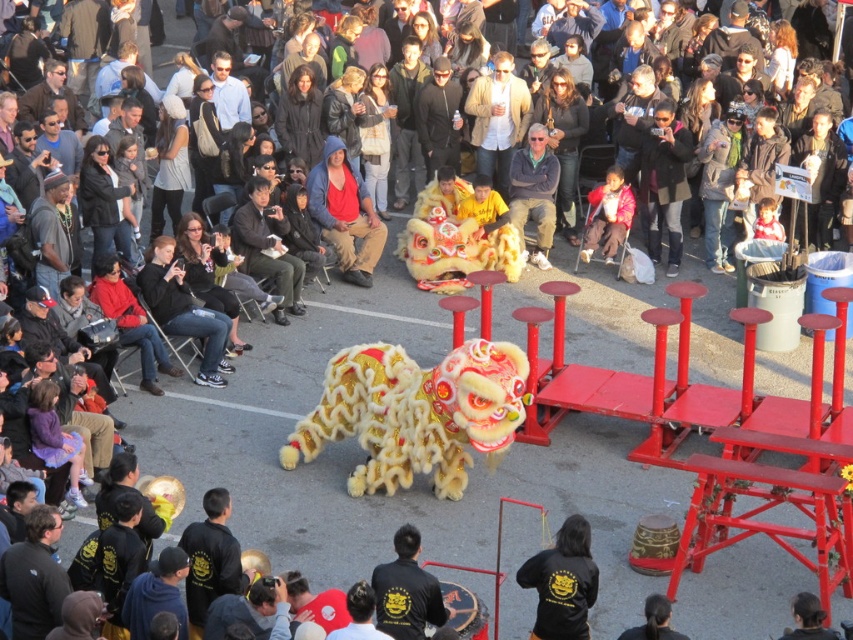
Between point (793, 620) and point (662, 604), which one is positioned behind?

The point (793, 620) is behind.

Based on the photo, can you confirm if dark brown hair at center is smaller than black hair at center?

Correct, dark brown hair at center occupies less space than black hair at center.

Who is more forward, (791,611) or (635,634)?

Point (635,634)

The width and height of the screenshot is (853, 640). I want to click on dark brown hair at center, so click(808, 620).

Is yellow furry lion at center positioned at the back of black matte jacket at center?

Yes, yellow furry lion at center is behind black matte jacket at center.

Who is positioned more to the left, yellow furry lion at center or black matte jacket at center?

black matte jacket at center is more to the left.

Is point (431, 250) in front of point (409, 621)?

That is False.

You are a GUI agent. You are given a task and a screenshot of the screen. Output one action in this format:
    pyautogui.click(x=<x>, y=<y>)
    Task: Click on the yellow furry lion at center
    This screenshot has height=640, width=853.
    Given the screenshot: What is the action you would take?
    pyautogui.click(x=456, y=250)

In the scene shown: Does red cotton shirt at center appear over black matte jacket at lower center?

Yes, red cotton shirt at center is above black matte jacket at lower center.

Which is behind, point (355, 189) or point (581, 563)?

The point (355, 189) is behind.

Which is in front, point (358, 212) or point (555, 545)?

Positioned in front is point (555, 545).

I want to click on red cotton shirt at center, so click(x=344, y=212).